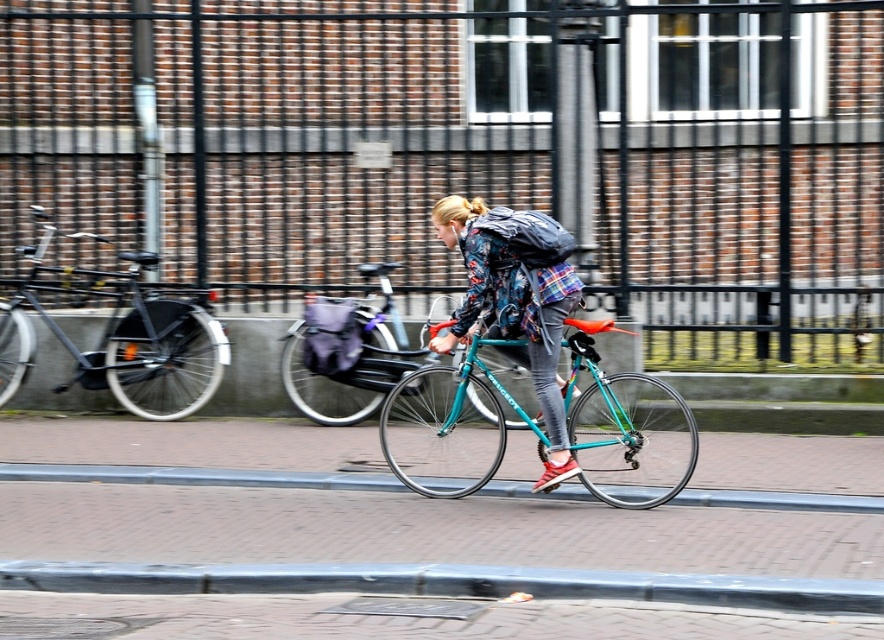
Does smooth concrete curb at lower center have a smaller size compared to teal glossy bicycle at center?

Yes, smooth concrete curb at lower center is smaller than teal glossy bicycle at center.

What do you see at coordinates (447, 582) in the screenshot?
I see `smooth concrete curb at lower center` at bounding box center [447, 582].

Which is in front, point (753, 579) or point (561, 284)?

Point (753, 579) is more forward.

The image size is (884, 640). I want to click on smooth concrete curb at lower center, so click(447, 582).

Who is higher up, brick pavement at center or matte black bicycle at left?

matte black bicycle at left is higher up.

Who is positioned more to the left, brick pavement at center or matte black bicycle at left?

From the viewer's perspective, matte black bicycle at left appears more on the left side.

The image size is (884, 640). I want to click on brick pavement at center, so click(427, 529).

In the scene shown: Between smooth concrete curb at lower center and brick at lower center, which one has more height?

smooth concrete curb at lower center is taller.

Which is more to the left, smooth concrete curb at lower center or brick at lower center?

brick at lower center is more to the left.

Describe the element at coordinates (447, 582) in the screenshot. The height and width of the screenshot is (640, 884). I see `smooth concrete curb at lower center` at that location.

Where is `smooth concrete curb at lower center`? smooth concrete curb at lower center is located at coordinates (447, 582).